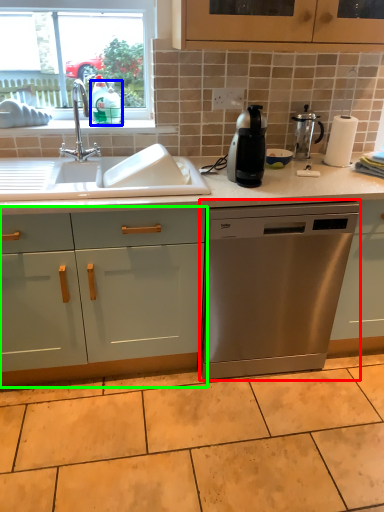
Question: Considering the real-world distances, which object is farthest from dishwasher (highlighted by a red box)? teal (highlighted by a blue box) or cabinetry (highlighted by a green box)?

Choices:
 (A) teal
 (B) cabinetry

Answer: (A)